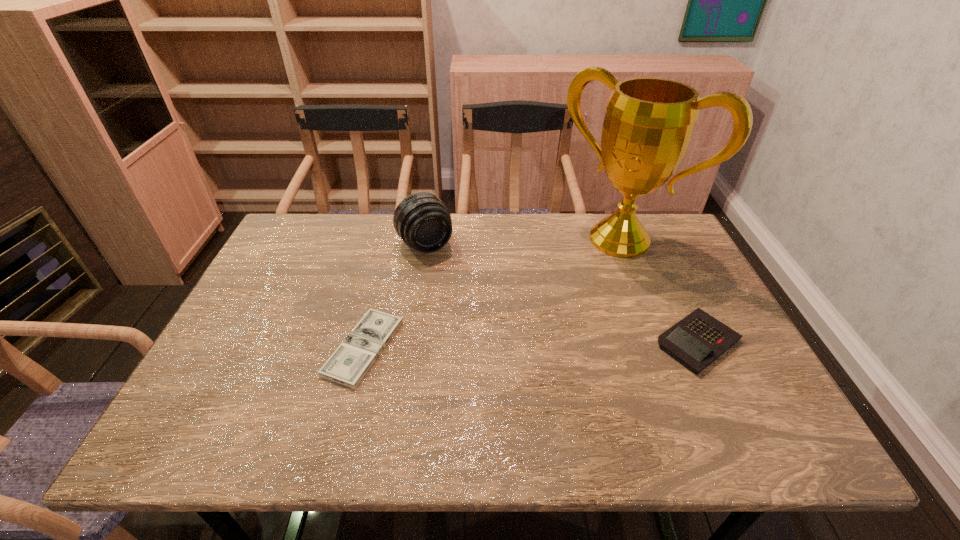
The image size is (960, 540). In the image, there is a desktop. What are the coordinates of `vacant space at the far edge` in the screenshot? It's located at (567, 250).

Identify the location of free point at the near edge. (488, 397).

This screenshot has width=960, height=540. I want to click on vacant area at the right edge of the desktop, so click(x=695, y=276).

Where is `free space at the far left corner`? The height and width of the screenshot is (540, 960). free space at the far left corner is located at coordinates (324, 257).

Locate an element on the screen. This screenshot has width=960, height=540. blank space at the near left corner of the desktop is located at coordinates (242, 375).

You are a GUI agent. You are given a task and a screenshot of the screen. Output one action in this format:
    pyautogui.click(x=<x>, y=<y>)
    Task: Click on the vacant space that's between the second shortest object and the shortest object
    This screenshot has height=540, width=960.
    Given the screenshot: What is the action you would take?
    pyautogui.click(x=531, y=345)

At what (x,y) coordinates should I click in order to perform the action: click on empty space that is in between the telephoto lens and the tallest object. Please return your answer as a coordinate pair (x, y). The image size is (960, 540). Looking at the image, I should click on (522, 242).

Locate an element on the screen. This screenshot has width=960, height=540. free point between the dollar and the calculator is located at coordinates (531, 345).

At what (x,y) coordinates should I click in order to perform the action: click on free spot between the dollar and the second tallest object. Please return your answer as a coordinate pair (x, y). This screenshot has width=960, height=540. Looking at the image, I should click on [395, 296].

This screenshot has height=540, width=960. I want to click on vacant space that's between the shortest object and the second tallest object, so click(395, 296).